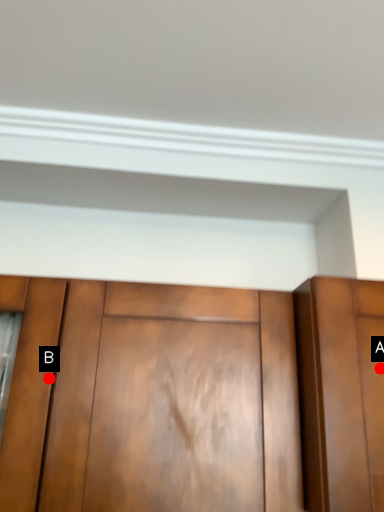
Question: Two points are circled on the image, labeled by A and B beside each circle. Which of the following is the closest to the observer?

Choices:
 (A) A is closer
 (B) B is closer

Answer: (A)